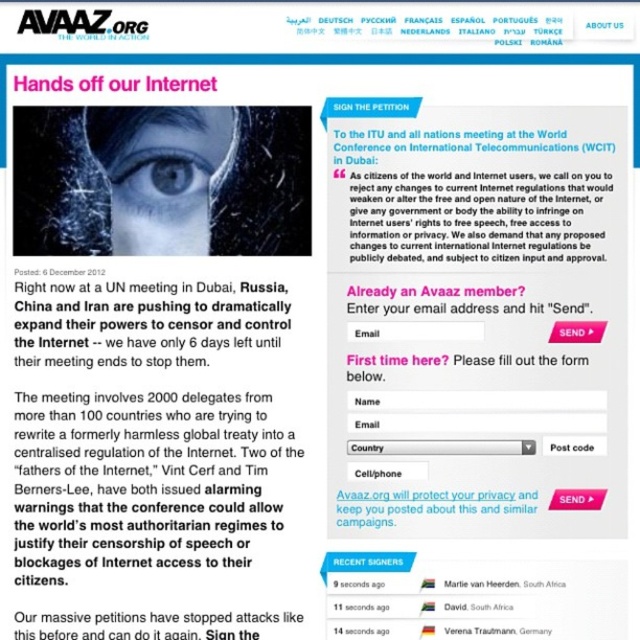
What is located at the coordinates point (147, 625)?

The black paper text at lower center is located at point (147, 625).

What is the 2D coordinate of the white paper text at upper center?

The 2D coordinate of the white paper text at upper center is at point (x=474, y=216).

Based on the provided scene description, what does the point at coordinates (474, 216) correspond to?

The point at coordinates (474, 216) corresponds to the white paper text at upper center.